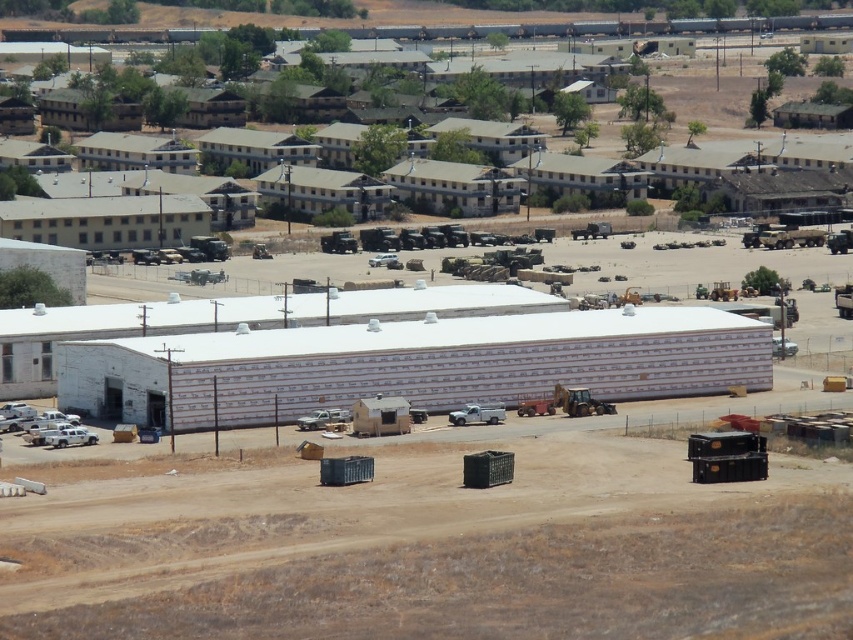
You are a drone operator tasked with capturing aerial footage of the brown dirt field at lower center and the gray concrete buildings at upper center. Which area should you focus on first if you want to film the larger structure?

The gray concrete buildings at upper center are larger than the brown dirt field at lower center, so you should focus on filming the gray concrete buildings at upper center first.

You are a drone operator tasked with landing a drone on the brown dirt field at lower center. However, there are gray concrete buildings at upper center in the way. Based on the scene description, can you safely land the drone on the dirt field without flying over the buildings?

The brown dirt field at lower center is below gray concrete buildings at upper center, so the drone can safely land on the dirt field without needing to fly over the buildings since it is positioned beneath them.

You are a drone operator tasked with landing a drone on the brown dirt field at lower center. From the perspective of the gray concrete buildings at upper center, which direction should you fly the drone to reach the landing area?

The brown dirt field at lower center is positioned on the left side of gray concrete buildings at upper center. Therefore, to reach the landing area from the perspective of the gray concrete buildings at upper center, you should fly the drone to the left.